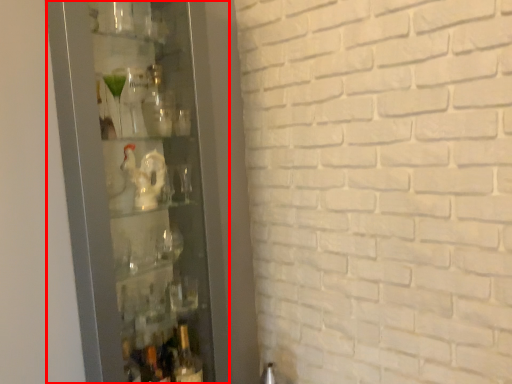
Question: Where is glass door (annotated by the red box) located in relation to bottle in the image?

Choices:
 (A) right
 (B) left

Answer: (B)